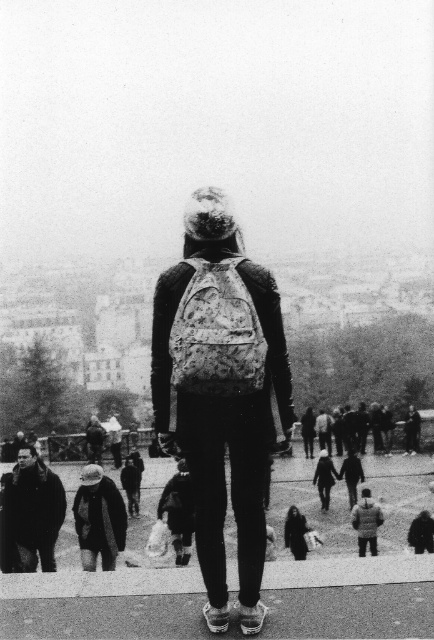
You are a tailor who needs to determine if a dark gray woolen hat at lower left can fit into a storage box that is designed to accommodate the dark gray wool coat at lower center. Based on the image, can the hat fit into the box?

The dark gray woolen hat at lower left might be wider than dark gray wool coat at lower center, so it may not fit into the box designed for the coat.

You are a photographer trying to capture the dark gray woolen hat at lower left located at point (98,518). The camera you are using has a field of view that can only capture objects within a 0.2 radius from the center. If you center your camera at point 0.7, 0.2, will the dark gray woolen hat at lower left be fully visible in the photo?

The dark gray woolen hat at lower left is located at point (98,518). The distance between the center point 0.7, 0.2 and the hat is calculated as sqrt of squared difference in x and y coordinates. The distance is sqrt of 0.111 squared plus 0.028 squared which equals approximately 0.115. Since 0.115 is less than 0.2, the hat will be fully visible within the camera field of view.

You are a photographer positioned at the camera location. You want to capture a closeup shot of the dark brown leather jacket at lower left. Given that your telephoto lens can focus on objects up to 50 meters away, will you be able to take the photo clearly?

The dark brown leather jacket at lower left is 52.52 meters away from the camera, which exceeds the telephoto lens maximum focus distance of 50 meters. Therefore, the jacket will be out of focus and the photo will not be clear.